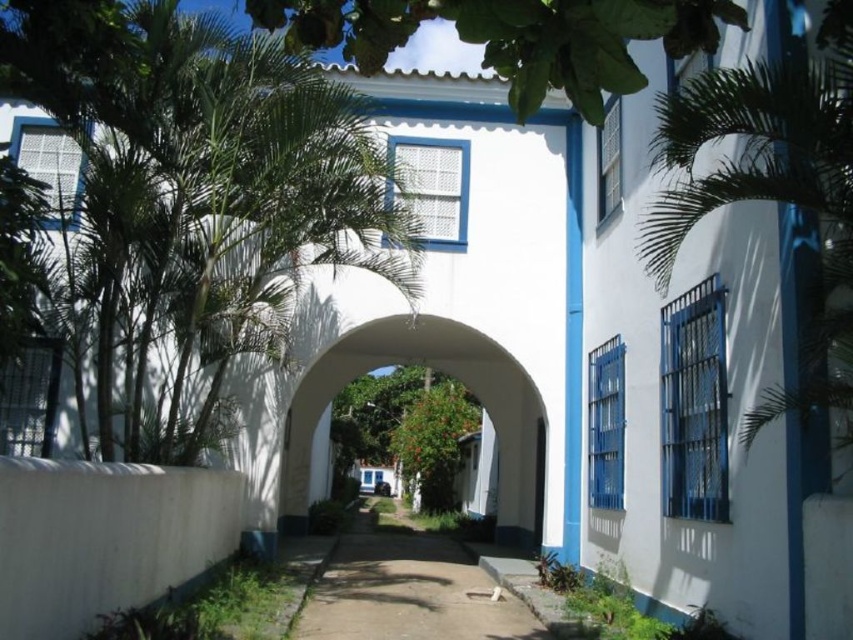
You are standing in front of the white building with blue trim and want to walk through the arched doorway. As you look at the green leafy palm tree at left and the green leafy palm at right, which one is closer to you?

The green leafy palm tree at left is closer to you because it is further to the viewer than the green leafy palm at right.

You are standing at the entrance of the white building with blue trim and looking towards the arched doorway. There is a point marked at coordinates point (512,36). What object is located at that point?

The point (512,36) corresponds to the green leafy tree at upper center.

You are a visitor trying to find the entrance to the white building with blue trim. You see a green leafy tree at upper center and a brown dirt path at center. Which object is closer to the entrance of the building?

The brown dirt path at center is closer to the entrance of the building because it is larger than the green leafy tree at upper center, which is smaller and farther away.